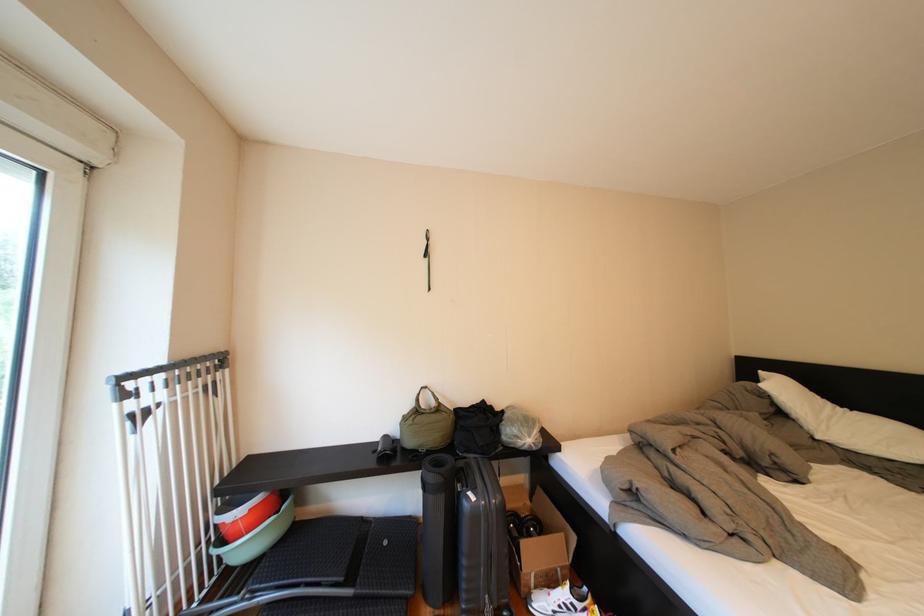
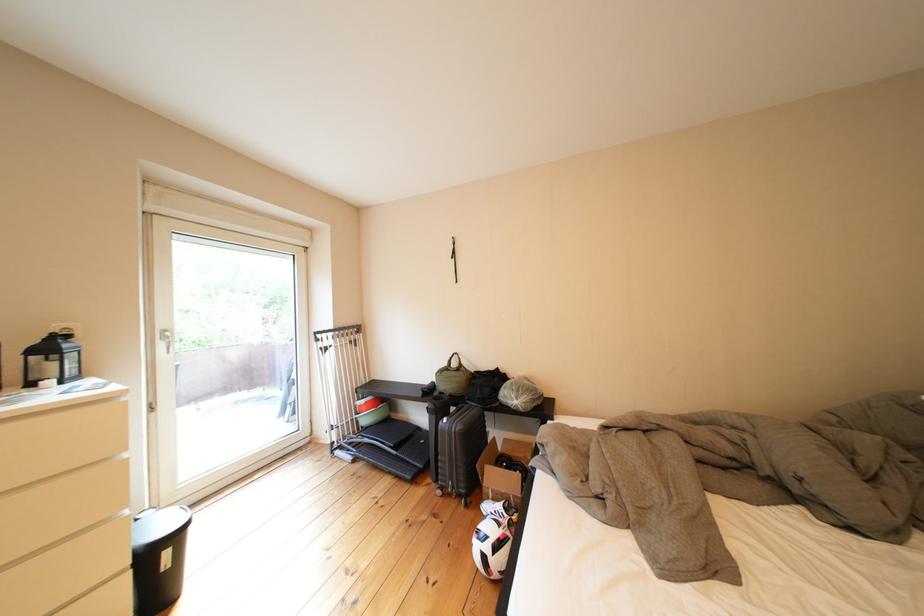
The point at (440, 392) is marked in the first image. Where is the corresponding point in the second image?

(469, 358)